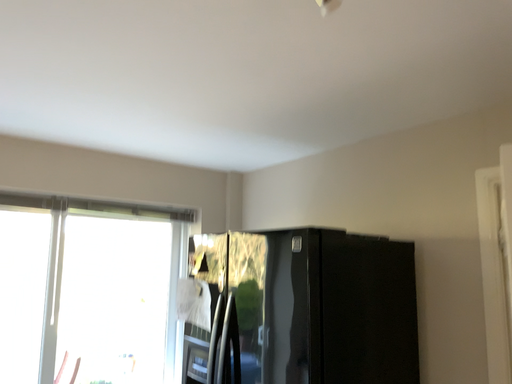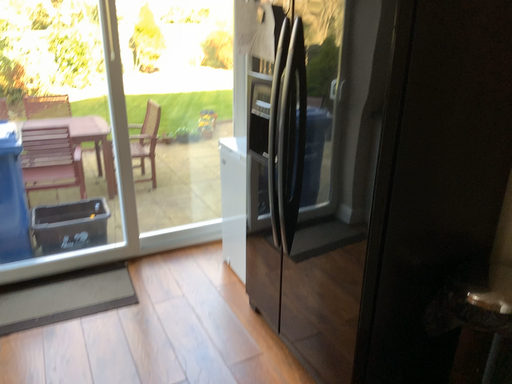
Question: Which way did the camera rotate in the video?

Choices:
 (A) rotated upward
 (B) rotated downward

Answer: (B)